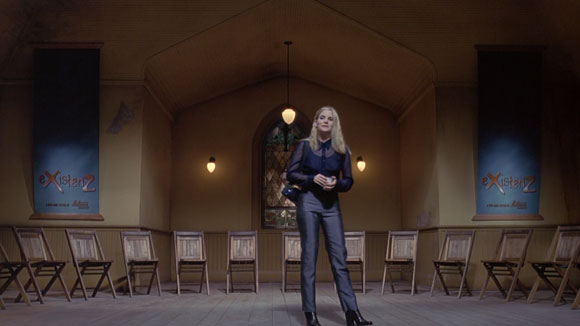
This screenshot has width=580, height=326. I want to click on bulb, so click(213, 163).